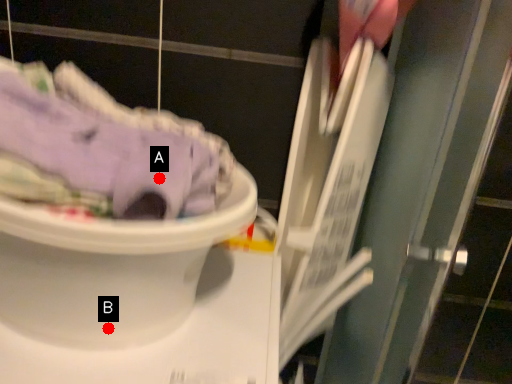
Question: Two points are circled on the image, labeled by A and B beside each circle. Which point is farther to the camera?

Choices:
 (A) A is further
 (B) B is further

Answer: (B)